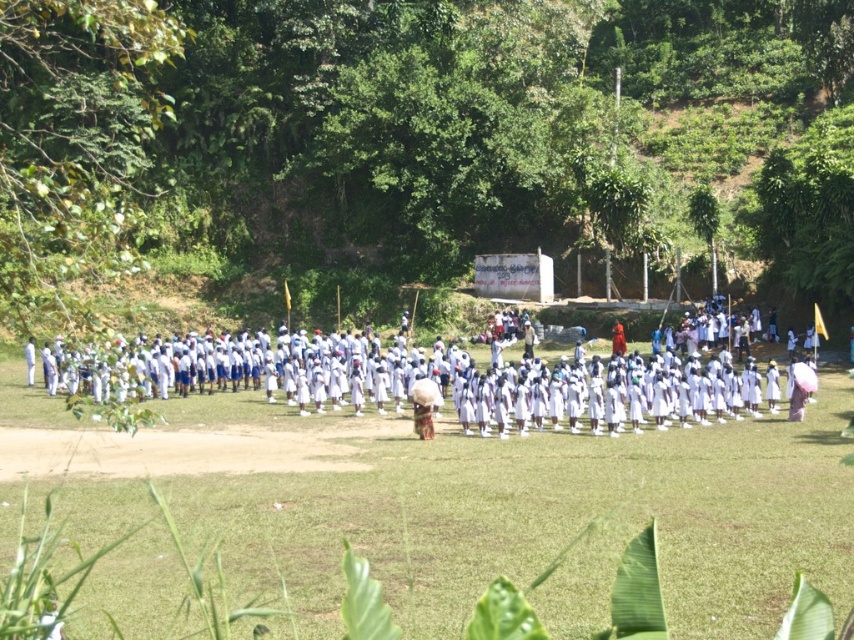
Question: Can you confirm if white fabric at center is positioned to the right of white cotton uniform at center?

Choices:
 (A) no
 (B) yes

Answer: (B)

Question: Observing the image, what is the correct spatial positioning of white fabric at center in reference to white cotton uniform at center?

Choices:
 (A) left
 (B) right

Answer: (B)

Question: Among these points, which one is nearest to the camera?

Choices:
 (A) (414, 483)
 (B) (402, 369)

Answer: (A)

Question: Among these objects, which one is farthest from the camera?

Choices:
 (A) white fabric at center
 (B) white cotton uniform at center

Answer: (A)

Question: Is the position of white fabric at center less distant than that of white cotton uniform at center?

Choices:
 (A) no
 (B) yes

Answer: (A)

Question: Which point appears closest to the camera in this image?

Choices:
 (A) (822, 406)
 (B) (722, 378)

Answer: (A)